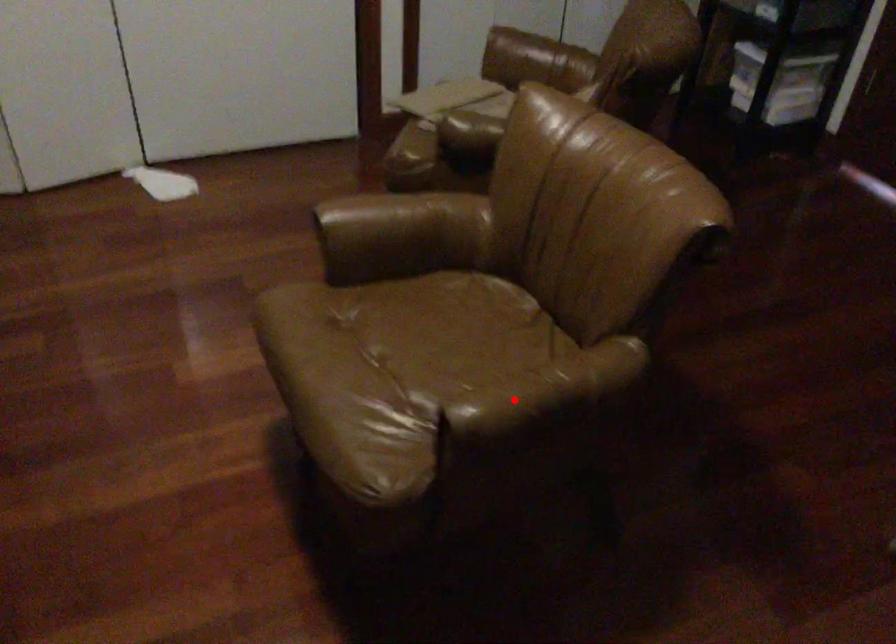
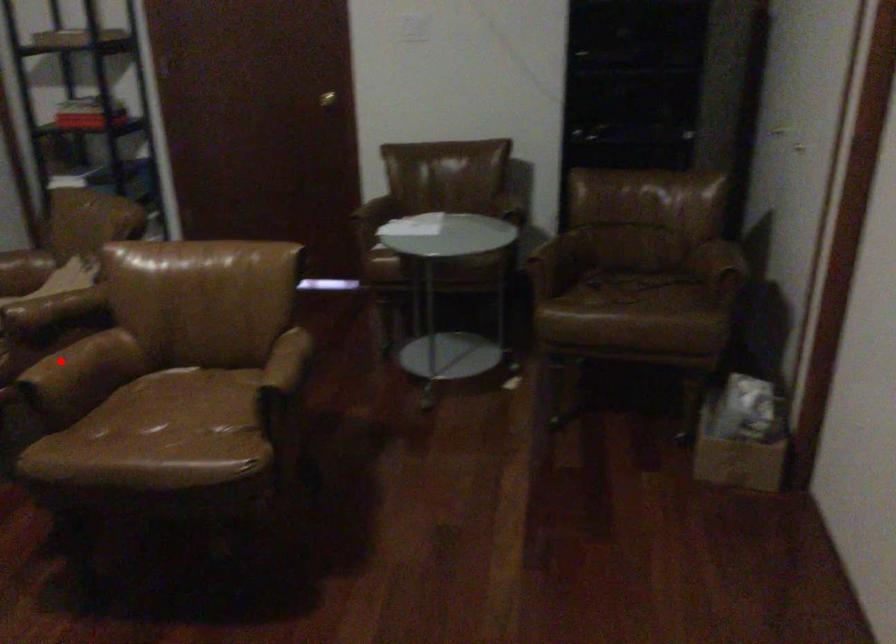
I am providing you with two images of the same scene from different viewpoints. A red point is marked on the first image and another point is marked on the second image. Do the highlighted points in image1 and image2 indicate the same real-world spot?

No